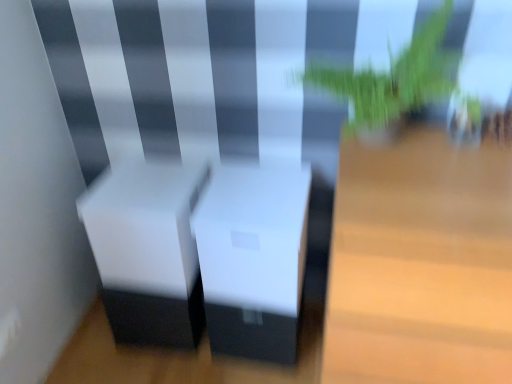
Question: Is light wood table at center, positioned as the second table in left-to-right order, taller or shorter than white matte table at center, which is counted as the 1th table, starting from the left?

Choices:
 (A) tall
 (B) short

Answer: (A)

Question: Considering their positions, is light wood table at center, positioned as the second table in left-to-right order, located in front of or behind white matte table at center, which is counted as the 1th table, starting from the left?

Choices:
 (A) front
 (B) behind

Answer: (A)

Question: Which object is the closest to the green leafy plant at upper right?

Choices:
 (A) light wood table at center, which is the 1th table in right-to-left order
 (B) white matte table at center, which is counted as the 1th table, starting from the left

Answer: (A)

Question: Considering the real-world distances, which object is farthest from the light wood table at center, which is the 1th table in right-to-left order?

Choices:
 (A) white matte table at center, positioned as the second table in right-to-left order
 (B) green leafy plant at upper right

Answer: (A)